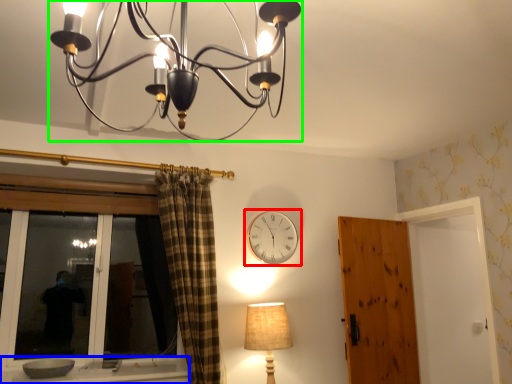
Question: Based on their relative distances, which object is nearer to wall clock (highlighted by a red box)? Choose from window sill (highlighted by a blue box) and lamp (highlighted by a green box).

Choices:
 (A) window sill
 (B) lamp

Answer: (A)